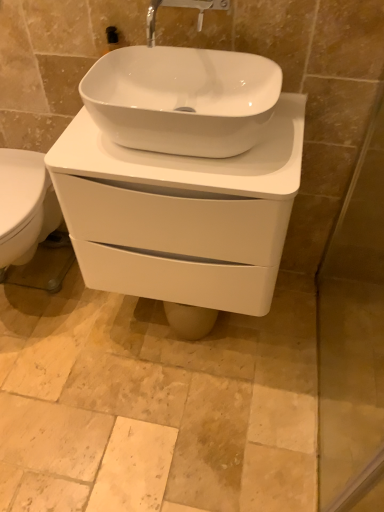
Question: Does matte silver faucet at upper center have a lesser width compared to transparent glass screen door at right?

Choices:
 (A) yes
 (B) no

Answer: (B)

Question: Is matte silver faucet at upper center wider than transparent glass screen door at right?

Choices:
 (A) no
 (B) yes

Answer: (B)

Question: Is matte silver faucet at upper center closer to the viewer compared to transparent glass screen door at right?

Choices:
 (A) yes
 (B) no

Answer: (B)

Question: Considering the relative sizes of matte silver faucet at upper center and transparent glass screen door at right in the image provided, is matte silver faucet at upper center bigger than transparent glass screen door at right?

Choices:
 (A) yes
 (B) no

Answer: (B)

Question: Is matte silver faucet at upper center to the left of transparent glass screen door at right from the viewer's perspective?

Choices:
 (A) no
 (B) yes

Answer: (B)

Question: Is matte silver faucet at upper center to the right of transparent glass screen door at right from the viewer's perspective?

Choices:
 (A) no
 (B) yes

Answer: (A)

Question: Would you say white glossy porcelain at center is outside transparent glass screen door at right?

Choices:
 (A) no
 (B) yes

Answer: (B)

Question: Does white glossy porcelain at center have a greater width compared to transparent glass screen door at right?

Choices:
 (A) yes
 (B) no

Answer: (A)

Question: From a real-world perspective, is white glossy porcelain at center on transparent glass screen door at right?

Choices:
 (A) no
 (B) yes

Answer: (B)

Question: Is white glossy porcelain at center further to the viewer compared to transparent glass screen door at right?

Choices:
 (A) no
 (B) yes

Answer: (B)

Question: From the image's perspective, is white glossy porcelain at center located beneath transparent glass screen door at right?

Choices:
 (A) no
 (B) yes

Answer: (A)

Question: Does white glossy porcelain at center appear on the left side of transparent glass screen door at right?

Choices:
 (A) yes
 (B) no

Answer: (A)

Question: From the image's perspective, is white glossy porcelain at center located above matte silver faucet at upper center?

Choices:
 (A) no
 (B) yes

Answer: (A)